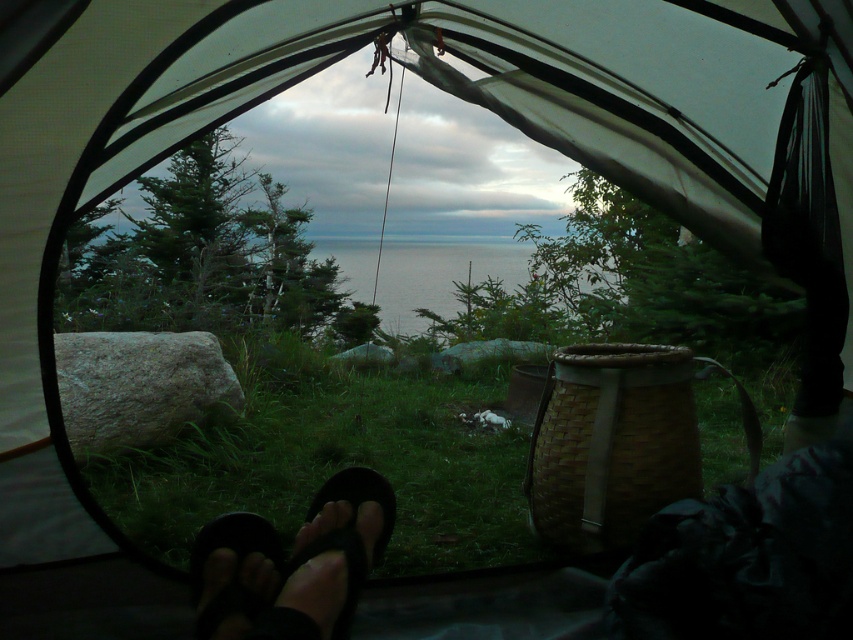
Who is more distant from viewer, (x=221, y=531) or (x=317, y=506)?

Point (x=317, y=506)

Is black rubber flip-flop at lower left taller than black matte sandal at lower center?

Indeed, black rubber flip-flop at lower left has a greater height compared to black matte sandal at lower center.

I want to click on black rubber flip-flop at lower left, so click(x=234, y=566).

Locate an element on the screen. The width and height of the screenshot is (853, 640). black rubber flip-flop at lower left is located at coordinates (234, 566).

Who is positioned more to the right, black rubber sandals at lower center or black rubber flip-flop at lower left?

black rubber sandals at lower center is more to the right.

Which of these two, black rubber sandals at lower center or black rubber flip-flop at lower left, stands taller?

Standing taller between the two is black rubber sandals at lower center.

Describe the element at coordinates (291, 561) in the screenshot. I see `black rubber sandals at lower center` at that location.

Where is `black rubber sandals at lower center`? black rubber sandals at lower center is located at coordinates (291, 561).

Describe the element at coordinates (291, 561) in the screenshot. I see `black rubber sandals at lower center` at that location.

Who is positioned more to the right, black rubber sandals at lower center or black matte sandal at lower center?

From the viewer's perspective, black matte sandal at lower center appears more on the right side.

Which is behind, point (251, 525) or point (384, 477)?

Point (384, 477)

Identify the location of black rubber sandals at lower center. The height and width of the screenshot is (640, 853). (291, 561).